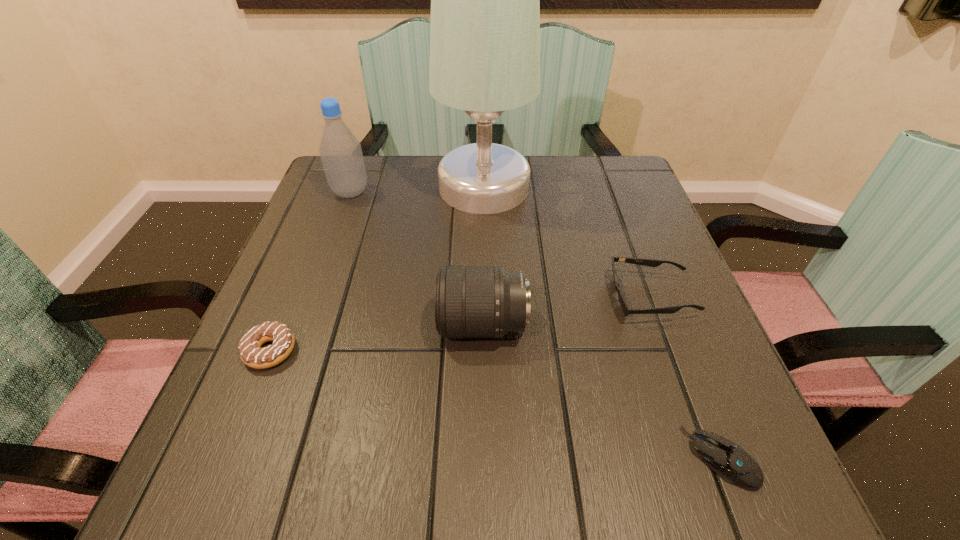
Locate an element on the screen. vacant region between the shortest object and the lampshade is located at coordinates (602, 322).

Image resolution: width=960 pixels, height=540 pixels. What are the coordinates of `vacant point located between the telephoto lens and the fourth tallest object` in the screenshot? It's located at (567, 311).

What are the coordinates of `vacant region between the computer mouse and the fifth tallest object` in the screenshot? It's located at (495, 404).

The image size is (960, 540). Identify the location of object that is the second closest one to the lampshade. click(626, 309).

Identify which object is located as the fourth nearest to the lampshade. Please provide its 2D coordinates. Your answer should be formatted as a tuple, i.e. [(x, y)], where the tuple contains the x and y coordinates of a point satisfying the conditions above.

[(251, 353)]

The height and width of the screenshot is (540, 960). Identify the location of free location that satisfies the following two spatial constraints: 1. on the surface of the third tallest object; 2. on the right side of the computer mouse. (484, 458).

The height and width of the screenshot is (540, 960). I want to click on blank area in the image that satisfies the following two spatial constraints: 1. on the front-facing side of the sunglasses; 2. on the back side of the nearest object, so pyautogui.click(x=710, y=458).

The height and width of the screenshot is (540, 960). Identify the location of vacant area in the image that satisfies the following two spatial constraints: 1. on the front-facing side of the fourth tallest object; 2. on the front side of the doughnut. (671, 351).

Locate an element on the screen. The height and width of the screenshot is (540, 960). free space that satisfies the following two spatial constraints: 1. on the front side of the shortest object; 2. on the right side of the second tallest object is located at coordinates (254, 458).

Locate an element on the screen. The image size is (960, 540). vacant space that satisfies the following two spatial constraints: 1. on the back side of the second shortest object; 2. on the right side of the second tallest object is located at coordinates (335, 192).